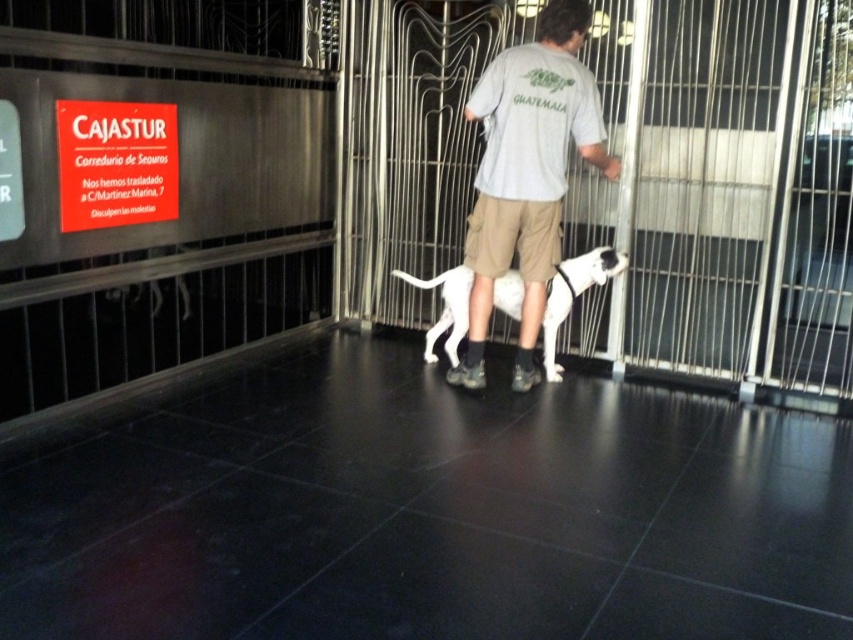
Where is `light gray t-shirt at center`? The height and width of the screenshot is (640, 853). light gray t-shirt at center is located at coordinates (527, 176).

Who is shorter, light gray t-shirt at center or white fur dog at center?

white fur dog at center is shorter.

What do you see at coordinates (527, 176) in the screenshot? The height and width of the screenshot is (640, 853). I see `light gray t-shirt at center` at bounding box center [527, 176].

Find the location of `light gray t-shirt at center`. light gray t-shirt at center is located at coordinates (527, 176).

Is red plastic sign at upper left closer to the viewer compared to white fur dog at center?

Yes, red plastic sign at upper left is in front of white fur dog at center.

This screenshot has width=853, height=640. I want to click on red plastic sign at upper left, so click(x=115, y=163).

Is point (167, 125) closer to viewer compared to point (447, 326)?

Yes, it is.

Identify the location of red plastic sign at upper left. The image size is (853, 640). (115, 163).

Which is in front, point (793, 330) or point (485, 216)?

Point (485, 216) is in front.

Which is above, metallic silver cage at center or light gray t-shirt at center?

Positioned higher is metallic silver cage at center.

The image size is (853, 640). I want to click on metallic silver cage at center, so point(715,196).